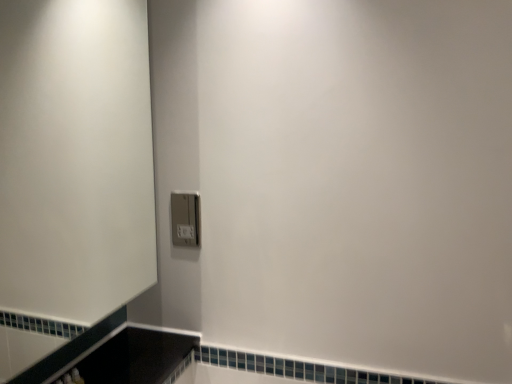
Question: Which is correct: white matte screen door at upper left is inside satin silver switch at lower center, or outside of it?

Choices:
 (A) inside
 (B) outside

Answer: (B)

Question: Considering the positions of white matte screen door at upper left and satin silver switch at lower center in the image, is white matte screen door at upper left taller or shorter than satin silver switch at lower center?

Choices:
 (A) tall
 (B) short

Answer: (A)

Question: Does point (71, 187) appear closer or farther from the camera than point (174, 223)?

Choices:
 (A) farther
 (B) closer

Answer: (A)

Question: From a real-world perspective, is satin silver switch at lower center positioned above or below white matte screen door at upper left?

Choices:
 (A) above
 (B) below

Answer: (B)

Question: Is satin silver switch at lower center wider or thinner than white matte screen door at upper left?

Choices:
 (A) thin
 (B) wide

Answer: (A)

Question: From the image's perspective, is satin silver switch at lower center positioned above or below white matte screen door at upper left?

Choices:
 (A) below
 (B) above

Answer: (A)

Question: Is satin silver switch at lower center inside or outside of white matte screen door at upper left?

Choices:
 (A) inside
 (B) outside

Answer: (B)